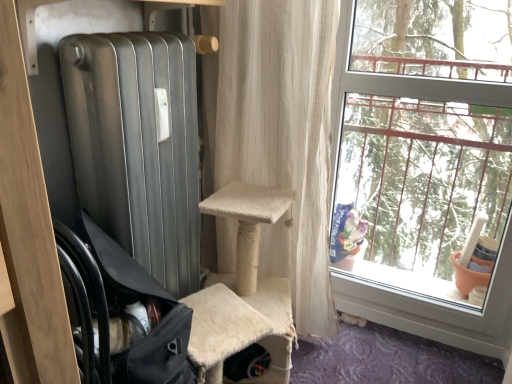
Question: Could black fabric chair at left be considered to be inside clear glass window at right?

Choices:
 (A) no
 (B) yes

Answer: (A)

Question: Can you confirm if clear glass window at right is taller than black fabric chair at left?

Choices:
 (A) no
 (B) yes

Answer: (B)

Question: Does clear glass window at right have a larger size compared to black fabric chair at left?

Choices:
 (A) no
 (B) yes

Answer: (B)

Question: From a real-world perspective, is clear glass window at right positioned under black fabric chair at left based on gravity?

Choices:
 (A) yes
 (B) no

Answer: (B)

Question: Is clear glass window at right positioned beyond the bounds of black fabric chair at left?

Choices:
 (A) no
 (B) yes

Answer: (B)

Question: From their relative heights in the image, would you say clear glass window at right is taller or shorter than black fabric chair at left?

Choices:
 (A) tall
 (B) short

Answer: (A)

Question: Do you think clear glass window at right is within black fabric chair at left, or outside of it?

Choices:
 (A) outside
 (B) inside

Answer: (A)

Question: Looking at their shapes, would you say clear glass window at right is wider or thinner than black fabric chair at left?

Choices:
 (A) thin
 (B) wide

Answer: (A)

Question: From a real-world perspective, relative to black fabric chair at left, is clear glass window at right vertically above or below?

Choices:
 (A) below
 (B) above

Answer: (B)

Question: From a real-world perspective, relative to clear glass window at right, is black fabric chair at left vertically above or below?

Choices:
 (A) below
 (B) above

Answer: (A)

Question: Based on their positions, is black fabric chair at left located to the left or right of clear glass window at right?

Choices:
 (A) right
 (B) left

Answer: (B)

Question: Looking at their shapes, would you say black fabric chair at left is wider or thinner than clear glass window at right?

Choices:
 (A) thin
 (B) wide

Answer: (B)

Question: Is black fabric chair at left situated inside clear glass window at right or outside?

Choices:
 (A) outside
 (B) inside

Answer: (A)

Question: In the image, is black fabric chair at left positioned in front of or behind white textured curtain at center?

Choices:
 (A) behind
 (B) front

Answer: (B)

Question: Visually, is black fabric chair at left positioned to the left or to the right of white textured curtain at center?

Choices:
 (A) left
 (B) right

Answer: (A)